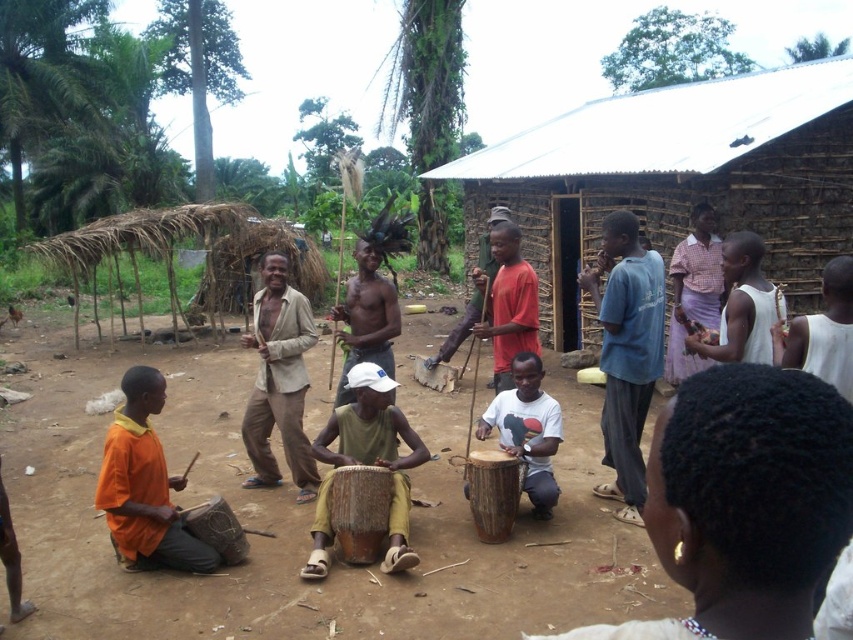
Question: Which of the following is the farthest from the observer?

Choices:
 (A) brown wooden drum at lower left
 (B) wooden drum at center
 (C) matte red drum at center

Answer: (C)

Question: Does orange fabric drum at lower left have a smaller size compared to matte red drum at center?

Choices:
 (A) no
 (B) yes

Answer: (A)

Question: Among these objects, which one is farthest from the camera?

Choices:
 (A) beige fabric shirt at center
 (B) white cotton shirt at center

Answer: (A)

Question: Among these points, which one is nearest to the camera?

Choices:
 (A) (120, 492)
 (B) (477, 301)
 (C) (300, 301)
 (D) (386, 504)

Answer: (A)

Question: Can you confirm if wooden drum at center is thinner than matte red drum at center?

Choices:
 (A) no
 (B) yes

Answer: (B)

Question: Does white matte drum at center have a lesser width compared to brown wooden drum at center?

Choices:
 (A) yes
 (B) no

Answer: (B)